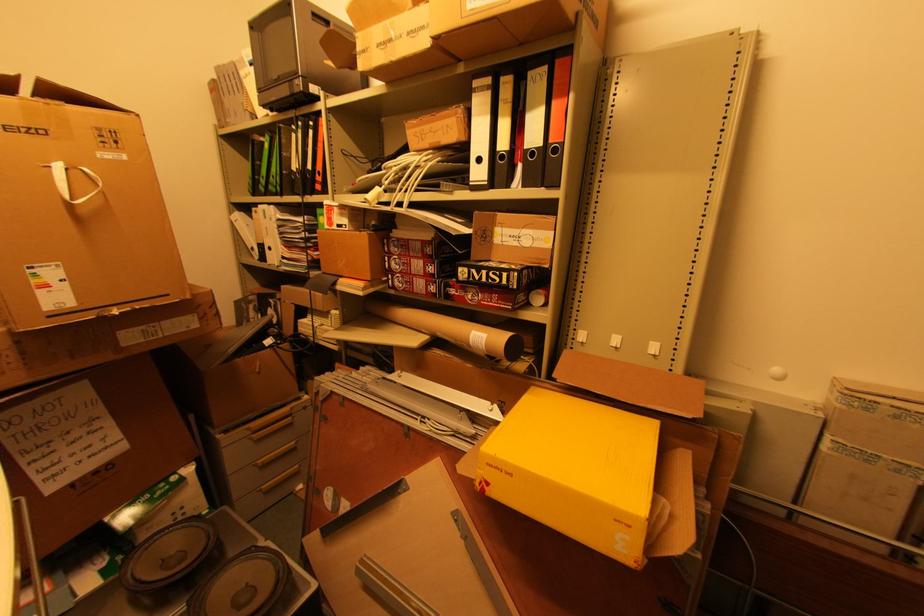
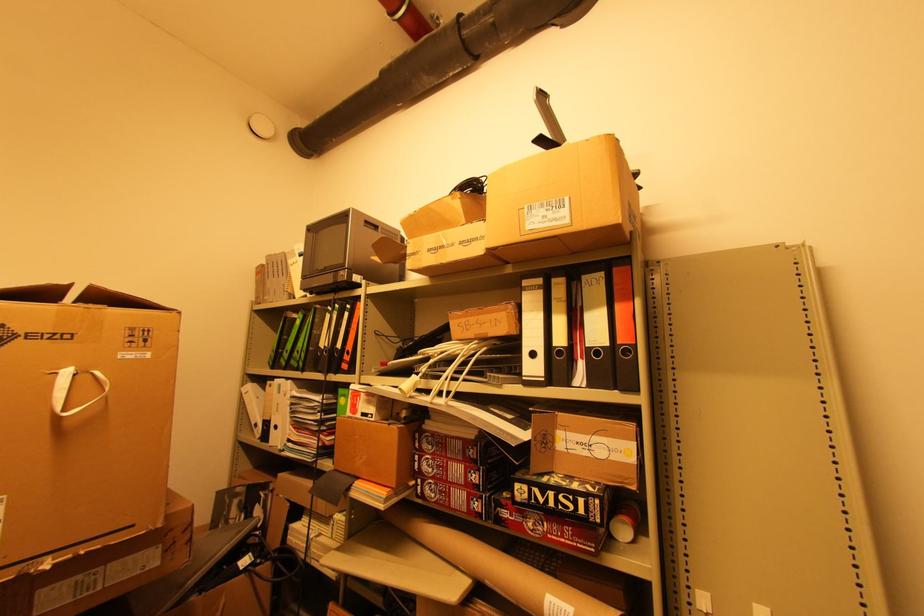
Where in the second image is the point corresponding to (x=120, y=314) from the first image?

(53, 568)